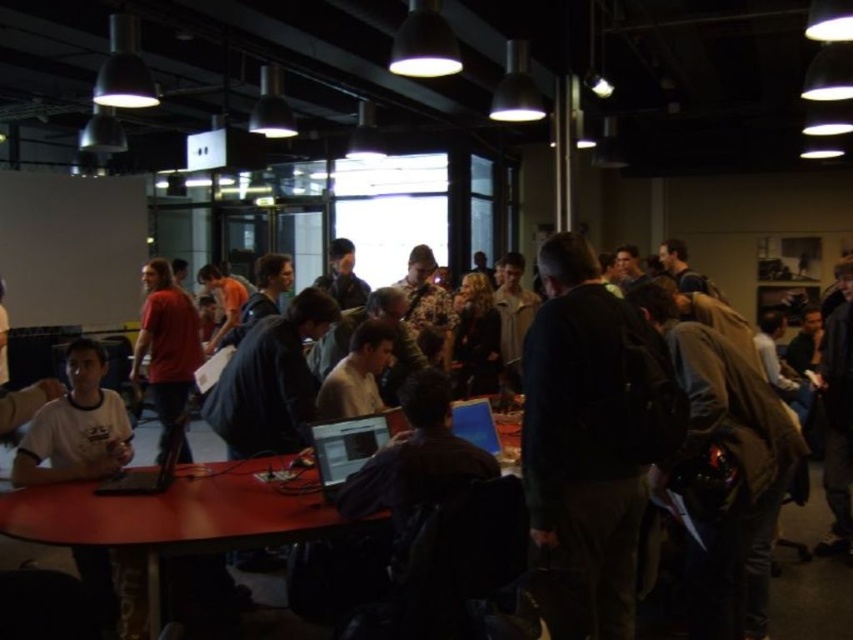
Which is above, dark blue shirt at center or matte red shirt at left?

matte red shirt at left is above.

Which is in front, point (28, 552) or point (177, 330)?

Point (28, 552) is in front.

Does point (846, 620) come closer to viewer compared to point (186, 348)?

Yes, point (846, 620) is closer to viewer.

Image resolution: width=853 pixels, height=640 pixels. What are the coordinates of `dark blue shirt at center` in the screenshot? It's located at [x=811, y=598].

Between point (247, 582) and point (354, 472), which one is positioned in front?

Positioned in front is point (354, 472).

Does dark blue shirt at center have a lesser width compared to shiny silver laptop at center?

In fact, dark blue shirt at center might be wider than shiny silver laptop at center.

What do you see at coordinates (811, 598) in the screenshot? I see `dark blue shirt at center` at bounding box center [811, 598].

Locate an element on the screen. Image resolution: width=853 pixels, height=640 pixels. dark blue shirt at center is located at coordinates (811, 598).

Can you confirm if dark blue shirt at center is shorter than matte black laptop at center?

Yes.

Does dark blue shirt at center lie in front of matte black laptop at center?

That is False.

At what (x,y) coordinates should I click in order to perform the action: click on dark blue shirt at center. Please return your answer as a coordinate pair (x, y). The image size is (853, 640). Looking at the image, I should click on (811, 598).